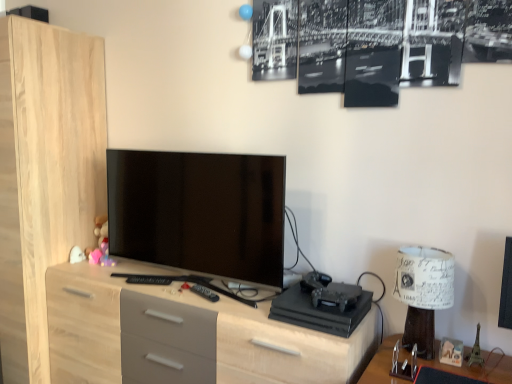
At what (x,y) coordinates should I click in order to perform the action: click on free region under matte black tv at center (from a real-world perspective). Please return your answer as a coordinate pair (x, y). Image resolution: width=512 pixels, height=384 pixels. Looking at the image, I should click on (204, 287).